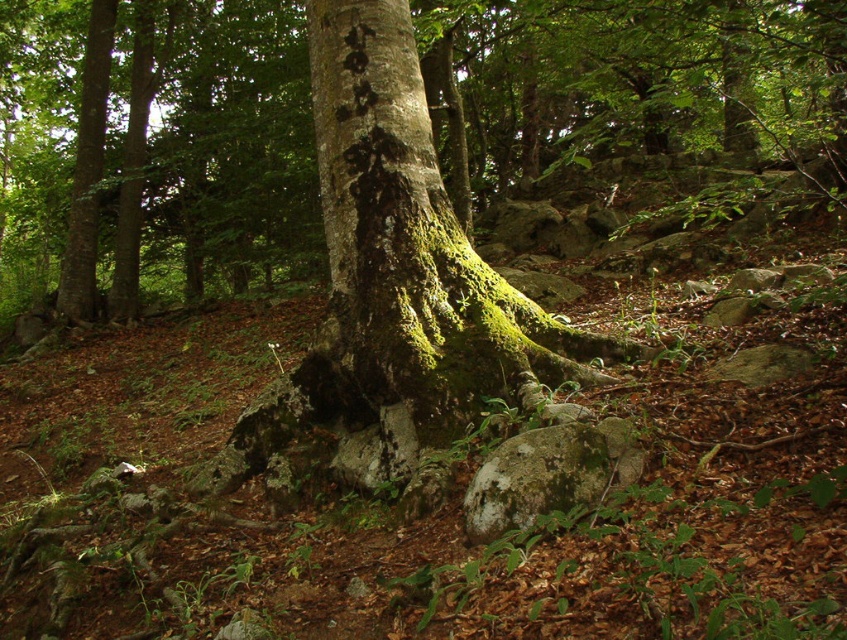
Is green mossy bark at center wider than green mossy rock at lower center?

Correct, the width of green mossy bark at center exceeds that of green mossy rock at lower center.

Identify the location of green mossy bark at center. (408, 248).

What do you see at coordinates (154, 148) in the screenshot? Image resolution: width=847 pixels, height=640 pixels. I see `green mossy tree trunk at center` at bounding box center [154, 148].

Does green mossy tree trunk at center appear on the left side of green mossy rock at lower center?

Indeed, green mossy tree trunk at center is positioned on the left side of green mossy rock at lower center.

The width and height of the screenshot is (847, 640). Describe the element at coordinates (154, 148) in the screenshot. I see `green mossy tree trunk at center` at that location.

Locate an element on the screen. This screenshot has height=640, width=847. green mossy tree trunk at center is located at coordinates (154, 148).

Looking at this image, can you confirm if green mossy tree trunk at center is smaller than green mossy bark at center?

Incorrect, green mossy tree trunk at center is not smaller in size than green mossy bark at center.

Describe the element at coordinates (154, 148) in the screenshot. The width and height of the screenshot is (847, 640). I see `green mossy tree trunk at center` at that location.

Find the location of a particular element. The width and height of the screenshot is (847, 640). green mossy tree trunk at center is located at coordinates (154, 148).